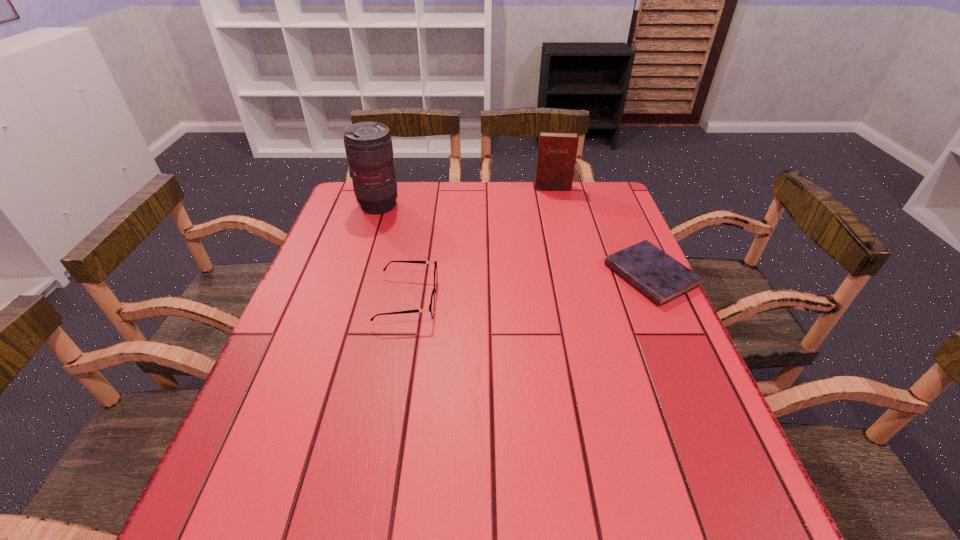
Locate an element on the screen. The height and width of the screenshot is (540, 960). vacant spot on the desktop that is between the third tallest object and the shorter diary and is positioned on the front cover of the second object from right to left is located at coordinates (560, 285).

In order to click on vacant space on the desktop that is between the third object from right to left and the nearer diary and is positioned on the side of the leftmost object where the control switches are located in this screenshot , I will do `click(521, 289)`.